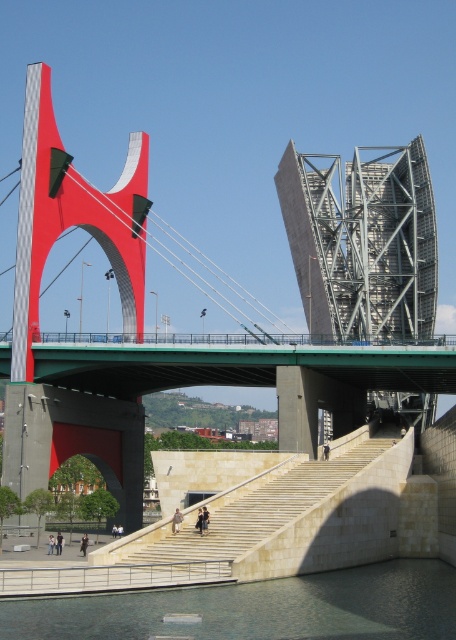
Which of these two, dark green water at lower center or light beige stone stairs at center, stands shorter?

With less height is dark green water at lower center.

Is dark green water at lower center positioned before light beige stone stairs at center?

Yes, dark green water at lower center is closer to the viewer.

This screenshot has width=456, height=640. Identify the location of dark green water at lower center. (258, 608).